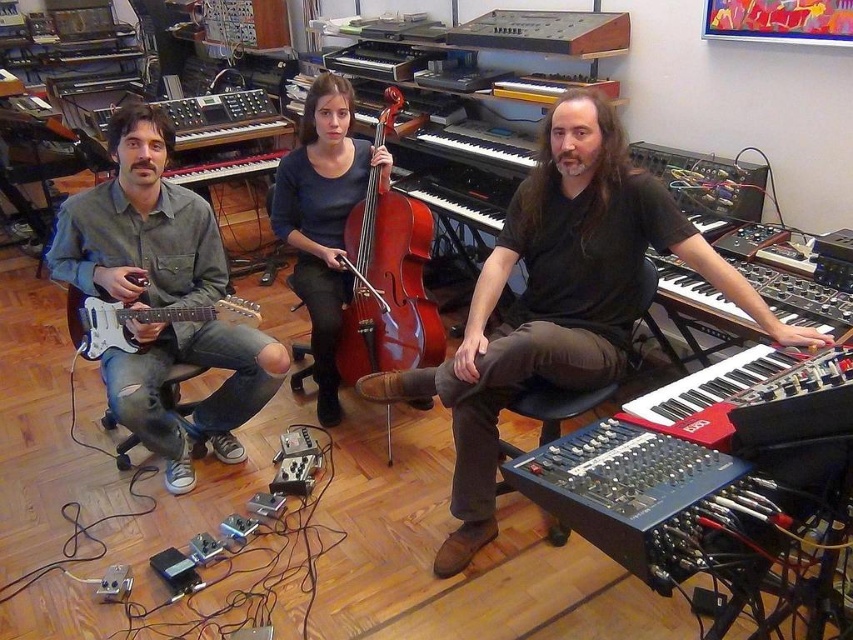
Question: Which of the following is the closest to the observer?

Choices:
 (A) coord(149,330)
 (B) coord(393,241)
 (C) coord(144,312)
 (D) coord(618,214)

Answer: (D)

Question: In this image, where is matte dark blue sweater at center located relative to brown matte cello at center?

Choices:
 (A) above
 (B) below

Answer: (B)

Question: Which of these objects is positioned closest to the matte dark blue sweater at center?

Choices:
 (A) matte white electric guitar at left
 (B) black matte keyboard at center
 (C) brown matte cello at center
 (D) matte black guitar at left

Answer: (C)

Question: Which is nearer to the matte white electric guitar at left?

Choices:
 (A) matte black guitar at left
 (B) black matte keyboard at center
 (C) brown matte cello at center

Answer: (A)

Question: Does black matte keyboard at center have a smaller size compared to matte dark blue sweater at center?

Choices:
 (A) no
 (B) yes

Answer: (A)

Question: Is matte black guitar at left to the left of matte white electric guitar at left from the viewer's perspective?

Choices:
 (A) no
 (B) yes

Answer: (A)